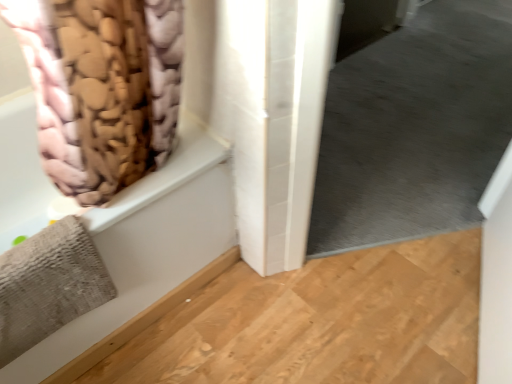
Question: Does point (110, 132) appear closer or farther from the camera than point (422, 99)?

Choices:
 (A) farther
 (B) closer

Answer: (B)

Question: Is pink fabric curtain at upper left spatially inside gray matte carpet at lower right, or outside of it?

Choices:
 (A) outside
 (B) inside

Answer: (A)

Question: Estimate the real-world distances between objects in this image. Which object is farther from the pink fabric curtain at upper left?

Choices:
 (A) beige fabric bath at left
 (B) gray matte carpet at lower right

Answer: (B)

Question: Which of these objects is positioned closest to the pink fabric curtain at upper left?

Choices:
 (A) beige fabric bath at left
 (B) gray matte carpet at lower right

Answer: (A)